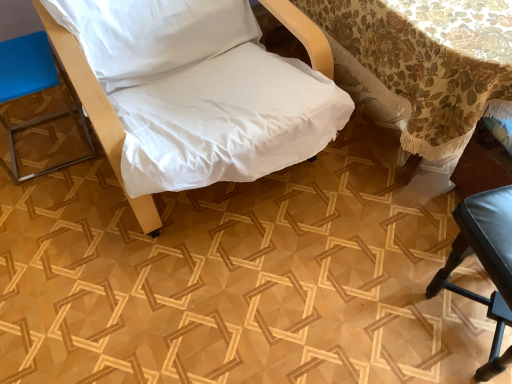
I want to click on floral lace tablecloth at upper right, so click(x=414, y=73).

What do you see at coordinates (414, 73) in the screenshot?
I see `floral lace tablecloth at upper right` at bounding box center [414, 73].

Image resolution: width=512 pixels, height=384 pixels. Describe the element at coordinates (482, 244) in the screenshot. I see `black leather chair at lower right, placed as the third furniture when sorted from left to right` at that location.

Find the location of a particular element. The width and height of the screenshot is (512, 384). black leather chair at lower right, which is the 1th furniture from right to left is located at coordinates (482, 244).

Locate an element on the screen. blue leather stool at left, the 1th furniture when ordered from left to right is located at coordinates (35, 92).

Locate an element on the screen. floral lace tablecloth at upper right is located at coordinates (414, 73).

From a real-world perspective, which is physically above, blue leather stool at left, marked as the third furniture in a right-to-left arrangement, or white fabric chair at center, which is counted as the second furniture, starting from the right?

From a 3D spatial view, white fabric chair at center, which is counted as the second furniture, starting from the right, is above.

Based on the photo, is blue leather stool at left, the 1th furniture when ordered from left to right, looking in the opposite direction of white fabric chair at center, which is counted as the second furniture, starting from the right?

No.

Where is `furniture that is the 2nd one when counting forward from the blue leather stool at left, marked as the third furniture in a right-to-left arrangement`? Image resolution: width=512 pixels, height=384 pixels. furniture that is the 2nd one when counting forward from the blue leather stool at left, marked as the third furniture in a right-to-left arrangement is located at coordinates (98, 112).

Would you consider blue leather stool at left, marked as the third furniture in a right-to-left arrangement, to be distant from white fabric chair at center, which is counted as the second furniture, starting from the right?

blue leather stool at left, marked as the third furniture in a right-to-left arrangement, is actually quite close to white fabric chair at center, which is counted as the second furniture, starting from the right.

Based on their sizes in the image, would you say white fabric chair at center, which is counted as the 2th furniture, starting from the left, is bigger or smaller than black leather chair at lower right, placed as the third furniture when sorted from left to right?

Clearly, white fabric chair at center, which is counted as the 2th furniture, starting from the left, is larger in size than black leather chair at lower right, placed as the third furniture when sorted from left to right.

Identify the location of furniture that is in front of the black leather chair at lower right, which is the 1th furniture from right to left. point(98,112).

From the image's perspective, is white fabric chair at center, which is counted as the second furniture, starting from the right, positioned above or below black leather chair at lower right, which is the 1th furniture from right to left?

Based on their image positions, white fabric chair at center, which is counted as the second furniture, starting from the right, is located above black leather chair at lower right, which is the 1th furniture from right to left.

Can you confirm if white fabric chair at center, which is counted as the 2th furniture, starting from the left, is wider than black leather chair at lower right, placed as the third furniture when sorted from left to right?

Yes, white fabric chair at center, which is counted as the 2th furniture, starting from the left, is wider than black leather chair at lower right, placed as the third furniture when sorted from left to right.

From the image's perspective, count 2nd furnitures downward from the white fabric chair at center, which is counted as the 2th furniture, starting from the left, and point to it. Please provide its 2D coordinates.

[(482, 244)]

Which point is more forward, [490,235] or [145,226]?

Positioned in front is point [490,235].

Can you tell me how much black leather chair at lower right, which is the 1th furniture from right to left, and white fabric chair at center, which is counted as the 2th furniture, starting from the left, differ in facing direction?

They differ by 11.4 degrees in their facing directions.

Could you tell me if black leather chair at lower right, placed as the third furniture when sorted from left to right, is turned towards white fabric chair at center, which is counted as the second furniture, starting from the right?

No, black leather chair at lower right, placed as the third furniture when sorted from left to right, is not aimed at white fabric chair at center, which is counted as the second furniture, starting from the right.

Can you confirm if white fabric chair at center, which is counted as the 2th furniture, starting from the left, is thinner than floral lace tablecloth at upper right?

Yes.

Is white fabric chair at center, which is counted as the second furniture, starting from the right, turned away from floral lace tablecloth at upper right?

No, floral lace tablecloth at upper right is not at the back of white fabric chair at center, which is counted as the second furniture, starting from the right.

Is white fabric chair at center, which is counted as the 2th furniture, starting from the left, bigger than floral lace tablecloth at upper right?

No.

Considering the relative positions of white fabric chair at center, which is counted as the 2th furniture, starting from the left, and floral lace tablecloth at upper right in the image provided, is white fabric chair at center, which is counted as the 2th furniture, starting from the left, in front of floral lace tablecloth at upper right?

Yes.

Is black leather chair at lower right, placed as the third furniture when sorted from left to right, inside floral lace tablecloth at upper right?

Actually, black leather chair at lower right, placed as the third furniture when sorted from left to right, is outside floral lace tablecloth at upper right.

Is point (354, 47) positioned in front of point (485, 246)?

No, (354, 47) is behind (485, 246).

Measure the distance between floral lace tablecloth at upper right and black leather chair at lower right, placed as the third furniture when sorted from left to right.

floral lace tablecloth at upper right and black leather chair at lower right, placed as the third furniture when sorted from left to right, are 14.51 inches apart.

From a real-world perspective, is floral lace tablecloth at upper right on top of black leather chair at lower right, placed as the third furniture when sorted from left to right?

Yes, from a real-world perspective, floral lace tablecloth at upper right is over black leather chair at lower right, placed as the third furniture when sorted from left to right

From the picture: Is black leather chair at lower right, placed as the third furniture when sorted from left to right, not close to blue leather stool at left, the 1th furniture when ordered from left to right?

Indeed, black leather chair at lower right, placed as the third furniture when sorted from left to right, is not near blue leather stool at left, the 1th furniture when ordered from left to right.

In terms of size, does black leather chair at lower right, which is the 1th furniture from right to left, appear bigger or smaller than blue leather stool at left, marked as the third furniture in a right-to-left arrangement?

Clearly, black leather chair at lower right, which is the 1th furniture from right to left, is larger in size than blue leather stool at left, marked as the third furniture in a right-to-left arrangement.

Is blue leather stool at left, the 1th furniture when ordered from left to right, surrounded by black leather chair at lower right, which is the 1th furniture from right to left?

That's incorrect, blue leather stool at left, the 1th furniture when ordered from left to right, is not inside black leather chair at lower right, which is the 1th furniture from right to left.

From the image's perspective, is black leather chair at lower right, which is the 1th furniture from right to left, on blue leather stool at left, marked as the third furniture in a right-to-left arrangement?

No, from the image's perspective, black leather chair at lower right, which is the 1th furniture from right to left, is not on top of blue leather stool at left, marked as the third furniture in a right-to-left arrangement.

Is black leather chair at lower right, placed as the third furniture when sorted from left to right, with floral lace tablecloth at upper right?

No.

Is black leather chair at lower right, placed as the third furniture when sorted from left to right, bigger than floral lace tablecloth at upper right?

Incorrect, black leather chair at lower right, placed as the third furniture when sorted from left to right, is not larger than floral lace tablecloth at upper right.

Which object is positioned more to the right, black leather chair at lower right, placed as the third furniture when sorted from left to right, or floral lace tablecloth at upper right?

black leather chair at lower right, placed as the third furniture when sorted from left to right.

Where is `the 2nd furniture behind the white fabric chair at center, which is counted as the second furniture, starting from the right, starting your count from the anchor`? This screenshot has height=384, width=512. the 2nd furniture behind the white fabric chair at center, which is counted as the second furniture, starting from the right, starting your count from the anchor is located at coordinates (35, 92).

Where is `furniture that is the 1st one when counting leftward from the black leather chair at lower right, placed as the third furniture when sorted from left to right`? Image resolution: width=512 pixels, height=384 pixels. furniture that is the 1st one when counting leftward from the black leather chair at lower right, placed as the third furniture when sorted from left to right is located at coordinates (98, 112).

Looking at the image, which one is located further to black leather chair at lower right, placed as the third furniture when sorted from left to right, white fabric chair at center, which is counted as the second furniture, starting from the right, or floral lace tablecloth at upper right?

Based on the image, white fabric chair at center, which is counted as the second furniture, starting from the right, appears to be further to black leather chair at lower right, placed as the third furniture when sorted from left to right.

Estimate the real-world distances between objects in this image. Which object is closer to blue leather stool at left, the 1th furniture when ordered from left to right, black leather chair at lower right, which is the 1th furniture from right to left, or floral lace tablecloth at upper right?

Among the two, floral lace tablecloth at upper right is located nearer to blue leather stool at left, the 1th furniture when ordered from left to right.

When comparing their distances from blue leather stool at left, the 1th furniture when ordered from left to right, does floral lace tablecloth at upper right or black leather chair at lower right, placed as the third furniture when sorted from left to right, seem further?

black leather chair at lower right, placed as the third furniture when sorted from left to right.

From the image, which object appears to be nearer to black leather chair at lower right, placed as the third furniture when sorted from left to right, white fabric chair at center, which is counted as the second furniture, starting from the right, or blue leather stool at left, marked as the third furniture in a right-to-left arrangement?

The object closer to black leather chair at lower right, placed as the third furniture when sorted from left to right, is white fabric chair at center, which is counted as the second furniture, starting from the right.

Considering their positions, is blue leather stool at left, marked as the third furniture in a right-to-left arrangement, positioned further to white fabric chair at center, which is counted as the 2th furniture, starting from the left, than black leather chair at lower right, placed as the third furniture when sorted from left to right?

black leather chair at lower right, placed as the third furniture when sorted from left to right, is positioned further to the anchor white fabric chair at center, which is counted as the 2th furniture, starting from the left.

From the picture: Looking at the image, which one is located closer to black leather chair at lower right, placed as the third furniture when sorted from left to right, floral lace tablecloth at upper right or blue leather stool at left, marked as the third furniture in a right-to-left arrangement?

Based on the image, floral lace tablecloth at upper right appears to be nearer to black leather chair at lower right, placed as the third furniture when sorted from left to right.

Looking at the image, which one is located closer to floral lace tablecloth at upper right, black leather chair at lower right, placed as the third furniture when sorted from left to right, or white fabric chair at center, which is counted as the 2th furniture, starting from the left?

Among the two, black leather chair at lower right, placed as the third furniture when sorted from left to right, is located nearer to floral lace tablecloth at upper right.

Which object lies nearer to the anchor point floral lace tablecloth at upper right, white fabric chair at center, which is counted as the second furniture, starting from the right, or black leather chair at lower right, which is the 1th furniture from right to left?

black leather chair at lower right, which is the 1th furniture from right to left, is closer to floral lace tablecloth at upper right.

Locate an element on the screen. table between white fabric chair at center, which is counted as the second furniture, starting from the right, and black leather chair at lower right, placed as the third furniture when sorted from left to right is located at coordinates (414, 73).

The height and width of the screenshot is (384, 512). Find the location of `furniture situated between blue leather stool at left, marked as the third furniture in a right-to-left arrangement, and floral lace tablecloth at upper right from left to right`. furniture situated between blue leather stool at left, marked as the third furniture in a right-to-left arrangement, and floral lace tablecloth at upper right from left to right is located at coordinates (98, 112).

Where is `furniture situated between blue leather stool at left, the 1th furniture when ordered from left to right, and black leather chair at lower right, which is the 1th furniture from right to left, from left to right`? furniture situated between blue leather stool at left, the 1th furniture when ordered from left to right, and black leather chair at lower right, which is the 1th furniture from right to left, from left to right is located at coordinates (98, 112).

Identify the location of table between blue leather stool at left, the 1th furniture when ordered from left to right, and black leather chair at lower right, placed as the third furniture when sorted from left to right. The image size is (512, 384). (414, 73).